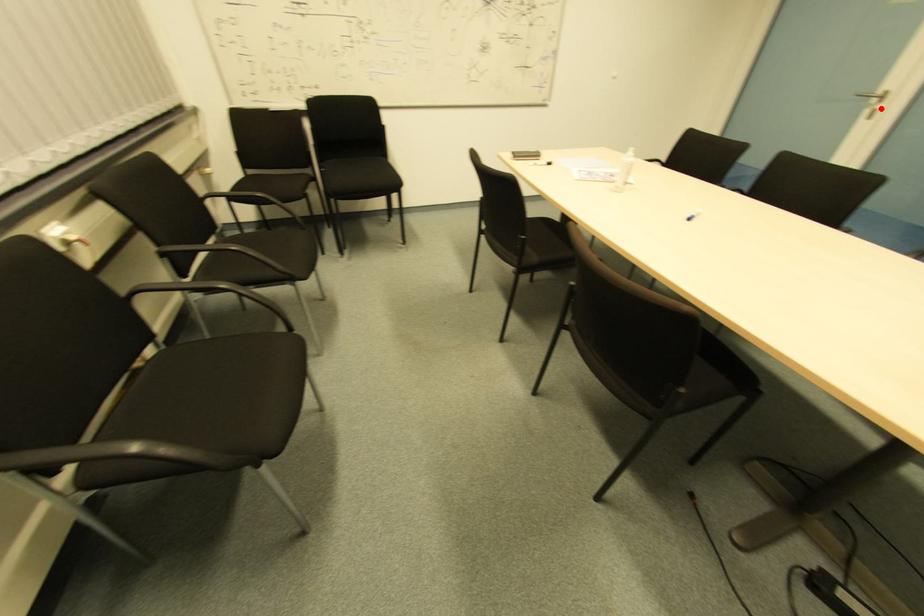
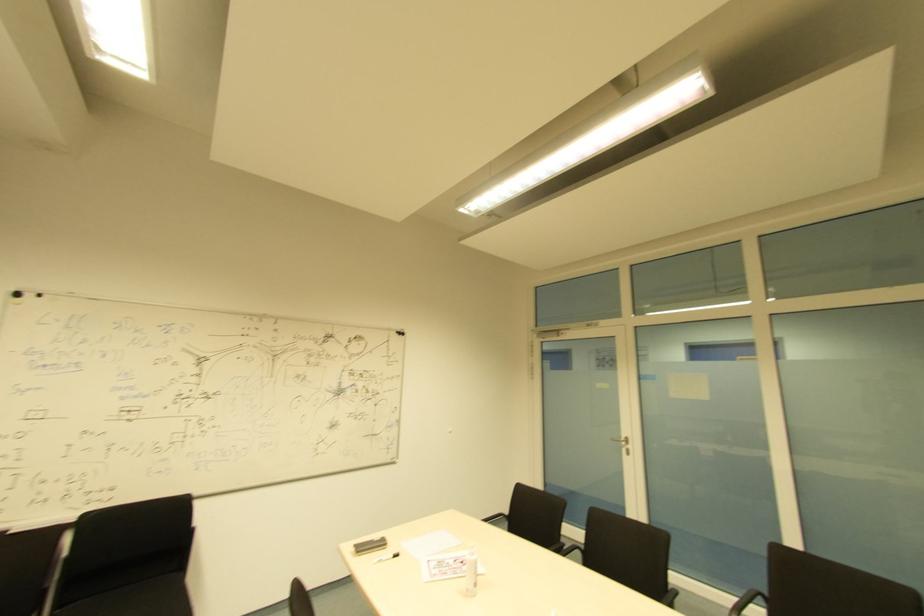
Question: I am providing you with two images of the same scene from different viewpoints. In image1, a red point is highlighted. Considering the same 3D point in image2, which of the following is correct?

Choices:
 (A) It is closer
 (B) It is farther

Answer: (A)